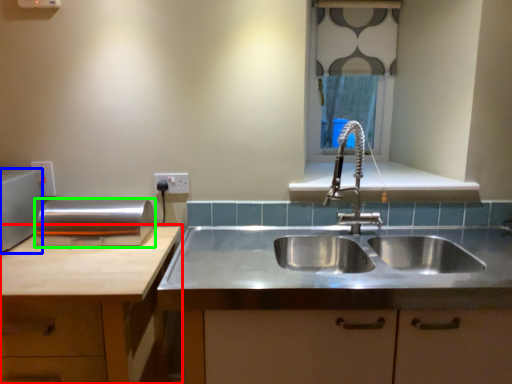
Question: Based on their relative distances, which object is nearer to cabinetry (highlighted by a red box)? Choose from appliance (highlighted by a blue box) and appliance (highlighted by a green box).

Choices:
 (A) appliance
 (B) appliance

Answer: (B)